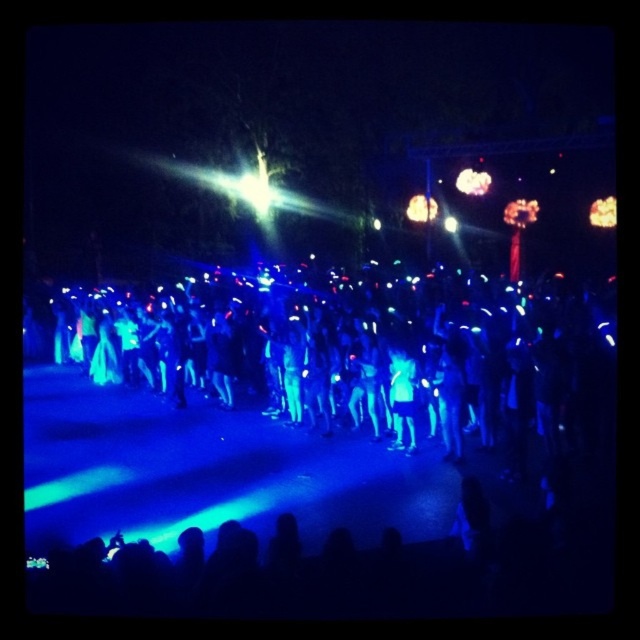
You are at an outdoor event and see the translucent amber light at upper right and the matte white light at center. Which light is positioned more to the east if you are facing north?

The translucent amber light at upper right is positioned more to the east because it is to the right of the matte white light at center when facing north.

You are at a nighttime event where the stage light is casting a blue hue. You notice a point in the image at coordinates point (602, 212). What color is the light source at that point?

The point (602, 212) indicates a translucent amber light at upper right, so the light source there is amber in color.